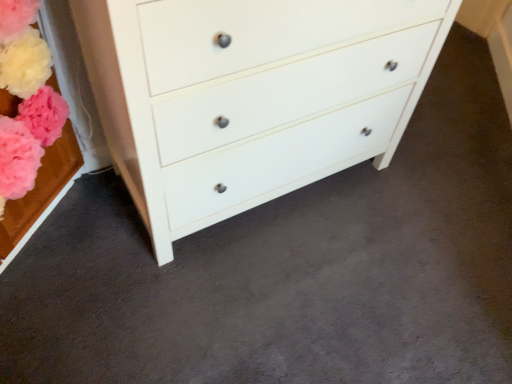
What are the coordinates of `vacant region in front of white matte chest of drawers at center` in the screenshot? It's located at (246, 301).